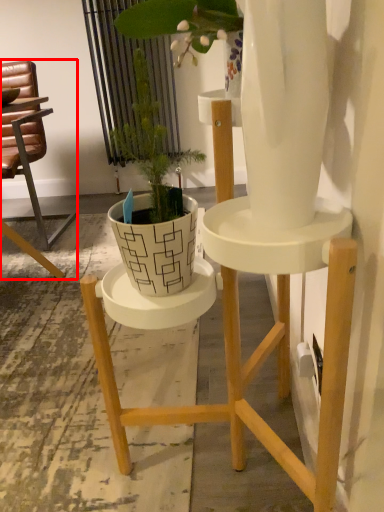
Question: From the image's perspective, where is chair (annotated by the red box) located in relation to houseplant in the image?

Choices:
 (A) below
 (B) above

Answer: (B)